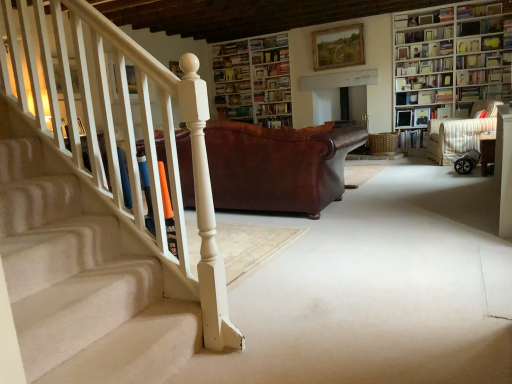
Question: In which direction should I rotate to look at hardcover book at upper center, marked as the eleventh book in a bottom-to-top arrangement?

Choices:
 (A) left
 (B) right

Answer: (A)

Question: Are white wooden bookcase at upper center, which appears as the 2th bookcase when viewed from the right, and hardcover book at center, marked as the 5th book in a bottom-to-top arrangement, making contact?

Choices:
 (A) yes
 (B) no

Answer: (B)

Question: From a real-world perspective, is white wooden bookcase at upper center, arranged as the first bookcase when viewed from the left, located higher than hardcover book at center, marked as the 5th book in a bottom-to-top arrangement?

Choices:
 (A) no
 (B) yes

Answer: (B)

Question: Would you say white wooden bookcase at upper center, arranged as the first bookcase when viewed from the left, is outside hardcover book at center, marked as the seventh book in a top-to-bottom arrangement?

Choices:
 (A) yes
 (B) no

Answer: (A)

Question: Does white wooden bookcase at upper center, which appears as the 2th bookcase when viewed from the right, have a greater height compared to hardcover book at center, marked as the seventh book in a top-to-bottom arrangement?

Choices:
 (A) no
 (B) yes

Answer: (B)

Question: Is white wooden bookcase at upper center, which is the 1th bookcase in back-to-front order, thinner than hardcover book at center, marked as the seventh book in a top-to-bottom arrangement?

Choices:
 (A) yes
 (B) no

Answer: (B)

Question: Considering the relative sizes of white wooden bookcase at upper center, arranged as the first bookcase when viewed from the left, and hardcover book at center, marked as the 5th book in a bottom-to-top arrangement, in the image provided, is white wooden bookcase at upper center, arranged as the first bookcase when viewed from the left, smaller than hardcover book at center, marked as the 5th book in a bottom-to-top arrangement,?

Choices:
 (A) yes
 (B) no

Answer: (B)

Question: Is hardcover book at upper right, placed as the 1th book when sorted from bottom to top, completely or partially inside wooden picture frame at upper center?

Choices:
 (A) no
 (B) yes

Answer: (A)

Question: Is wooden picture frame at upper center at the left side of hardcover book at upper right, placed as the 1th book when sorted from bottom to top?

Choices:
 (A) yes
 (B) no

Answer: (A)

Question: Considering the relative sizes of wooden picture frame at upper center and hardcover book at upper right, acting as the eleventh book starting from the top, in the image provided, is wooden picture frame at upper center shorter than hardcover book at upper right, acting as the eleventh book starting from the top,?

Choices:
 (A) no
 (B) yes

Answer: (A)

Question: From the image's perspective, would you say wooden picture frame at upper center is shown under hardcover book at upper right, placed as the 1th book when sorted from bottom to top?

Choices:
 (A) no
 (B) yes

Answer: (A)

Question: Is wooden picture frame at upper center smaller than hardcover book at upper right, acting as the eleventh book starting from the top?

Choices:
 (A) no
 (B) yes

Answer: (A)

Question: Can you confirm if wooden picture frame at upper center is bigger than hardcover book at upper right, placed as the 1th book when sorted from bottom to top?

Choices:
 (A) no
 (B) yes

Answer: (B)

Question: From a real-world perspective, is hardcover book at upper right, acting as the 9th book starting from the bottom, positioned under white wooden bookcase at upper center, arranged as the first bookcase when viewed from the left, based on gravity?

Choices:
 (A) no
 (B) yes

Answer: (A)